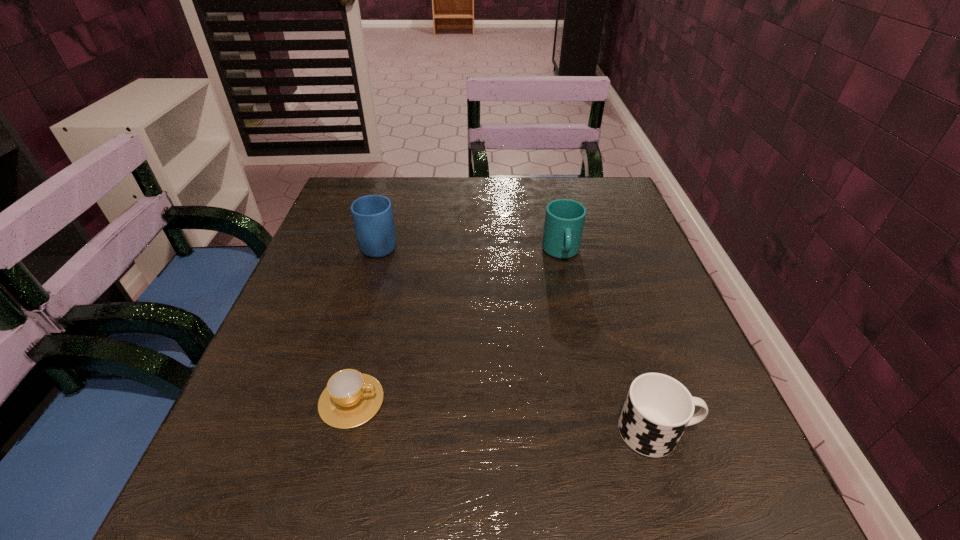
This screenshot has height=540, width=960. Identify the location of mug. (372, 215).

I want to click on the farthest cup, so click(x=564, y=222).

Locate an element on the screen. The height and width of the screenshot is (540, 960). the second tallest cup is located at coordinates 658,408.

The height and width of the screenshot is (540, 960). Identify the location of the shortest object. (351, 398).

What are the coordinates of `the leftmost cup` in the screenshot? It's located at (351, 398).

Where is `vacant region located on the side of the mug with the handle`? The height and width of the screenshot is (540, 960). vacant region located on the side of the mug with the handle is located at coordinates (396, 190).

Locate an element on the screen. This screenshot has height=540, width=960. vacant space located on the side of the mug with the handle is located at coordinates (390, 211).

Identify the location of free space located on the side of the mug with the handle. This screenshot has width=960, height=540. (395, 192).

Image resolution: width=960 pixels, height=540 pixels. What are the coordinates of `vacant region located on the handle side of the tallest cup` in the screenshot? It's located at (581, 336).

At what (x,y) coordinates should I click in order to perform the action: click on vacant space located on the side of the second shortest object with the handle. Please return your answer as a coordinate pair (x, y). The width and height of the screenshot is (960, 540). Looking at the image, I should click on (740, 431).